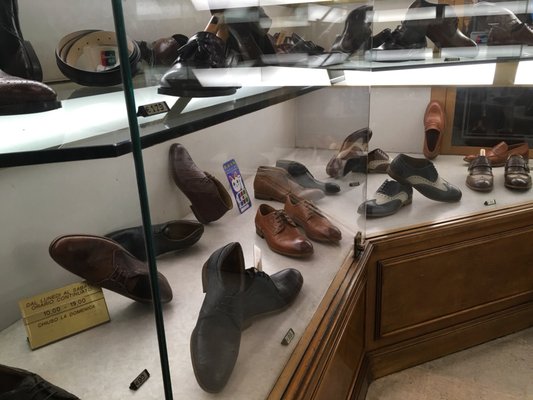
Identify the location of shelf. (94, 152), (246, 107).